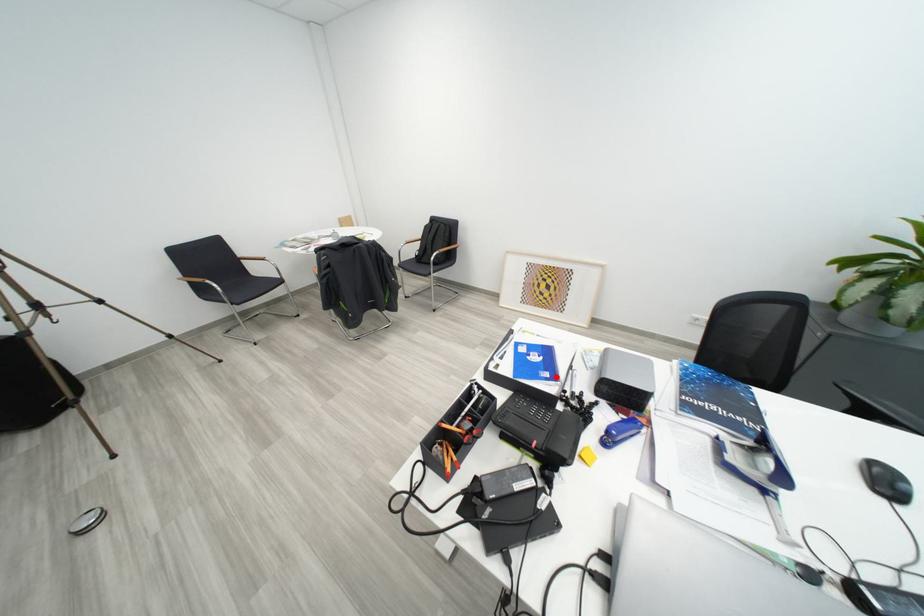
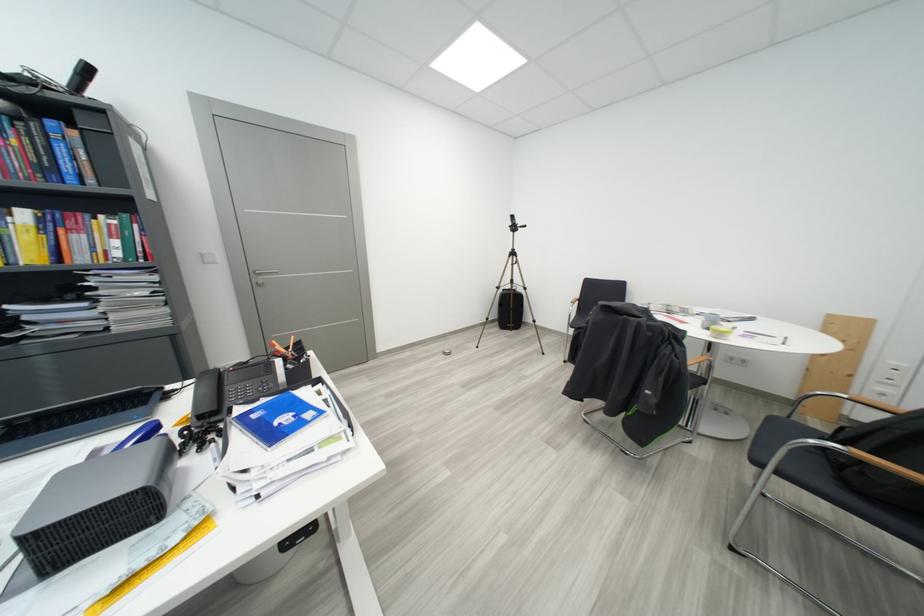
Question: I am providing you with two images of the same scene from different viewpoints. A red point is marked on the first image. At the location where the point appears in image 1, is it still visible in image 2?

Choices:
 (A) Yes
 (B) No

Answer: (A)